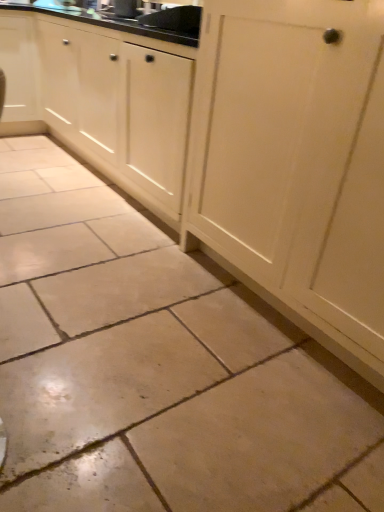
The height and width of the screenshot is (512, 384). Describe the element at coordinates (81, 86) in the screenshot. I see `matte white cabinet at upper left, arranged as the first cabinetry when viewed from the left` at that location.

Locate an element on the screen. The image size is (384, 512). matte white cabinet at upper left, arranged as the first cabinetry when viewed from the left is located at coordinates (81, 86).

Could you tell me if matte black sink at upper center is turned towards matte white cabinet at upper left, arranged as the 2th cabinetry when viewed from the right?

No, matte black sink at upper center does not turn towards matte white cabinet at upper left, arranged as the 2th cabinetry when viewed from the right.

Find the location of `sink lying above the matte white cabinet at upper left, arranged as the first cabinetry when viewed from the left (from the image's perspective)`. sink lying above the matte white cabinet at upper left, arranged as the first cabinetry when viewed from the left (from the image's perspective) is located at coordinates (125, 9).

Would you say matte black sink at upper center is inside or outside matte white cabinet at upper left, arranged as the first cabinetry when viewed from the left?

matte black sink at upper center is not enclosed by matte white cabinet at upper left, arranged as the first cabinetry when viewed from the left.

Is white wood cabinet at center, which is the first cabinetry in right-to-left order, inside or outside of matte black sink at upper center?

The correct answer is: outside.

You are a GUI agent. You are given a task and a screenshot of the screen. Output one action in this format:
    pyautogui.click(x=<x>, y=<y>)
    Task: Click on the sink above the white wood cabinet at center, which is the first cabinetry in right-to-left order (from the image's perspective)
    This screenshot has width=384, height=512.
    Given the screenshot: What is the action you would take?
    pyautogui.click(x=125, y=9)

From a real-world perspective, who is located lower, white wood cabinet at center, which is the first cabinetry in right-to-left order, or matte black sink at upper center?

white wood cabinet at center, which is the first cabinetry in right-to-left order, is physically lower.

Which object is positioned more to the left, matte white cabinet at upper left, arranged as the 2th cabinetry when viewed from the right, or matte black sink at upper center?

Positioned to the left is matte white cabinet at upper left, arranged as the 2th cabinetry when viewed from the right.

Between matte white cabinet at upper left, arranged as the 2th cabinetry when viewed from the right, and matte black sink at upper center, which one has smaller size?

matte black sink at upper center is smaller.

Is matte white cabinet at upper left, arranged as the 2th cabinetry when viewed from the right, thinner than matte black sink at upper center?

In fact, matte white cabinet at upper left, arranged as the 2th cabinetry when viewed from the right, might be wider than matte black sink at upper center.

From the image's perspective, is matte black sink at upper center below white wood cabinet at center, the second cabinetry when ordered from left to right?

Actually, matte black sink at upper center appears above white wood cabinet at center, the second cabinetry when ordered from left to right, in the image.

At what (x,y) coordinates should I click in order to perform the action: click on cabinetry that is in front of the matte black sink at upper center. Please return your answer as a coordinate pair (x, y). This screenshot has width=384, height=512. Looking at the image, I should click on (103, 98).

Is matte black sink at upper center directly adjacent to white wood cabinet at center, which is the first cabinetry in right-to-left order?

There is a gap between matte black sink at upper center and white wood cabinet at center, which is the first cabinetry in right-to-left order.

Can you confirm if matte black sink at upper center is shorter than white wood cabinet at center, which is the first cabinetry in right-to-left order?

Yes.

Consider the image. Considering the sizes of white wood cabinet at center, which is the first cabinetry in right-to-left order, and matte white cabinet at upper left, arranged as the first cabinetry when viewed from the left, in the image, is white wood cabinet at center, which is the first cabinetry in right-to-left order, wider or thinner than matte white cabinet at upper left, arranged as the first cabinetry when viewed from the left,?

white wood cabinet at center, which is the first cabinetry in right-to-left order, is thinner than matte white cabinet at upper left, arranged as the first cabinetry when viewed from the left.

Would you consider white wood cabinet at center, which is the first cabinetry in right-to-left order, to be distant from matte white cabinet at upper left, arranged as the 2th cabinetry when viewed from the right?

No.

Is white wood cabinet at center, which is the first cabinetry in right-to-left order, inside the boundaries of matte white cabinet at upper left, arranged as the first cabinetry when viewed from the left, or outside?

white wood cabinet at center, which is the first cabinetry in right-to-left order, lies outside matte white cabinet at upper left, arranged as the first cabinetry when viewed from the left.

Is white wood cabinet at center, the second cabinetry when ordered from left to right, at the right side of matte white cabinet at upper left, arranged as the first cabinetry when viewed from the left?

Yes.

Is there a large distance between matte white cabinet at upper left, arranged as the 2th cabinetry when viewed from the right, and white wood cabinet at center, the second cabinetry when ordered from left to right?

No, matte white cabinet at upper left, arranged as the 2th cabinetry when viewed from the right, is in close proximity to white wood cabinet at center, the second cabinetry when ordered from left to right.

Does matte white cabinet at upper left, arranged as the 2th cabinetry when viewed from the right, come behind white wood cabinet at center, which is the first cabinetry in right-to-left order?

Yes.

Considering the relative sizes of matte white cabinet at upper left, arranged as the first cabinetry when viewed from the left, and white wood cabinet at center, the second cabinetry when ordered from left to right, in the image provided, is matte white cabinet at upper left, arranged as the first cabinetry when viewed from the left, taller than white wood cabinet at center, the second cabinetry when ordered from left to right,?

Incorrect, the height of matte white cabinet at upper left, arranged as the first cabinetry when viewed from the left, is not larger of that of white wood cabinet at center, the second cabinetry when ordered from left to right.

Considering the relative positions of matte white cabinet at upper left, arranged as the first cabinetry when viewed from the left, and white wood cabinet at center, which is the first cabinetry in right-to-left order, in the image provided, is matte white cabinet at upper left, arranged as the first cabinetry when viewed from the left, to the left of white wood cabinet at center, which is the first cabinetry in right-to-left order, from the viewer's perspective?

Indeed, matte white cabinet at upper left, arranged as the first cabinetry when viewed from the left, is positioned on the left side of white wood cabinet at center, which is the first cabinetry in right-to-left order.

Locate an element on the screen. The width and height of the screenshot is (384, 512). sink lying above the matte white cabinet at upper left, arranged as the 2th cabinetry when viewed from the right (from the image's perspective) is located at coordinates (125, 9).

Locate an element on the screen. Image resolution: width=384 pixels, height=512 pixels. cabinetry in front of the matte black sink at upper center is located at coordinates (103, 98).

Estimate the real-world distances between objects in this image. Which object is closer to matte black sink at upper center, matte white cabinet at upper left, arranged as the 2th cabinetry when viewed from the right, or white wood cabinet at center, the second cabinetry when ordered from left to right?

matte white cabinet at upper left, arranged as the 2th cabinetry when viewed from the right, is positioned closer to the anchor matte black sink at upper center.

Based on their spatial positions, is matte white cabinet at upper left, arranged as the first cabinetry when viewed from the left, or matte black sink at upper center further from white wood cabinet at center, the second cabinetry when ordered from left to right?

Among the two, matte black sink at upper center is located further to white wood cabinet at center, the second cabinetry when ordered from left to right.

When comparing their distances from matte white cabinet at upper left, arranged as the 2th cabinetry when viewed from the right, does white wood cabinet at center, which is the first cabinetry in right-to-left order, or matte black sink at upper center seem closer?

white wood cabinet at center, which is the first cabinetry in right-to-left order.

Considering their positions, is matte black sink at upper center positioned further to matte white cabinet at upper left, arranged as the first cabinetry when viewed from the left, than white wood cabinet at center, which is the first cabinetry in right-to-left order?

matte black sink at upper center is further to matte white cabinet at upper left, arranged as the first cabinetry when viewed from the left.

Looking at the image, which one is located closer to white wood cabinet at center, which is the first cabinetry in right-to-left order, matte black sink at upper center or matte white cabinet at upper left, arranged as the first cabinetry when viewed from the left?

The object closer to white wood cabinet at center, which is the first cabinetry in right-to-left order, is matte white cabinet at upper left, arranged as the first cabinetry when viewed from the left.

Based on their spatial positions, is white wood cabinet at center, which is the first cabinetry in right-to-left order, or matte white cabinet at upper left, arranged as the first cabinetry when viewed from the left, further from matte black sink at upper center?

white wood cabinet at center, which is the first cabinetry in right-to-left order, lies further to matte black sink at upper center than the other object.

Image resolution: width=384 pixels, height=512 pixels. In order to click on sink located between white wood cabinet at center, the second cabinetry when ordered from left to right, and matte white cabinet at upper left, arranged as the 2th cabinetry when viewed from the right, in the depth direction in this screenshot , I will do `click(125, 9)`.